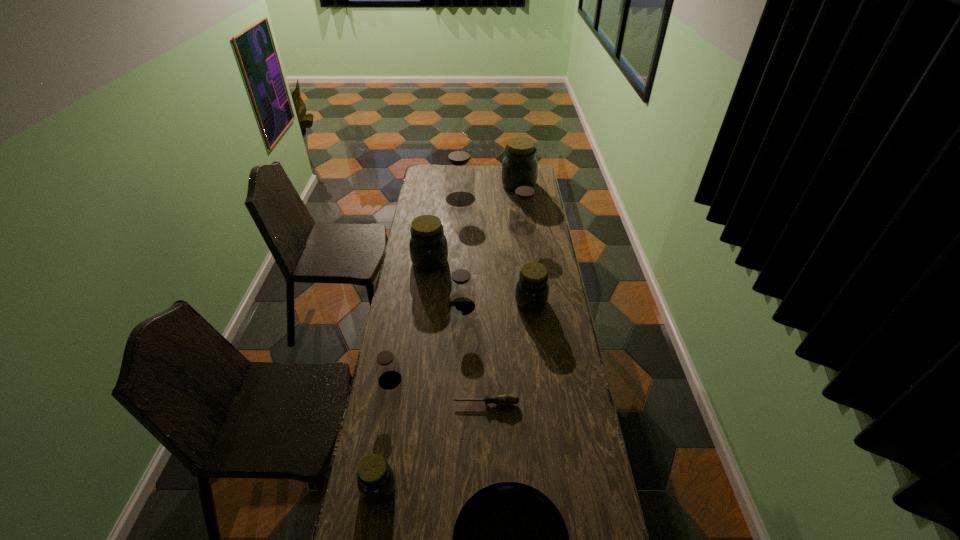
Where is `the farthest brown jar`? This screenshot has width=960, height=540. the farthest brown jar is located at coordinates point(459,173).

Identify the location of the biggest green jar. (519, 167).

Find the location of a particular element. The width and height of the screenshot is (960, 540). the eighth nearest object is located at coordinates (523, 205).

Identify the location of the third smallest brown jar. This screenshot has height=540, width=960. (523, 205).

This screenshot has height=540, width=960. I want to click on the fifth nearest jar, so click(428, 247).

The width and height of the screenshot is (960, 540). Identify the location of the third nearest green jar. click(428, 247).

The width and height of the screenshot is (960, 540). Identify the location of the third farthest brown jar. (461, 287).

What are the coordinates of `the second nearest green jar` in the screenshot? It's located at (532, 288).

Image resolution: width=960 pixels, height=540 pixels. Identify the location of the fourth nearest object. (386, 365).

Identify the location of the seventh farthest jar. [x=386, y=365].